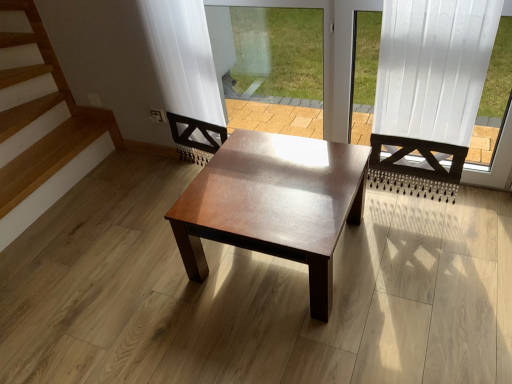
The width and height of the screenshot is (512, 384). Find the location of `free space that is to the left of shiny brown wood coffee table at center`. free space that is to the left of shiny brown wood coffee table at center is located at coordinates (139, 277).